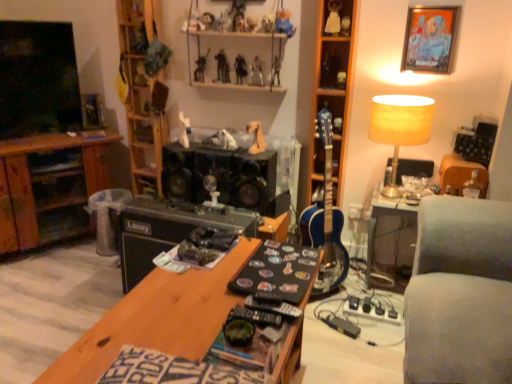
Find the location of `vacant area on the back side of white plush dog at center, the 5th toy in the left-to-right sequence`. vacant area on the back side of white plush dog at center, the 5th toy in the left-to-right sequence is located at coordinates (218, 142).